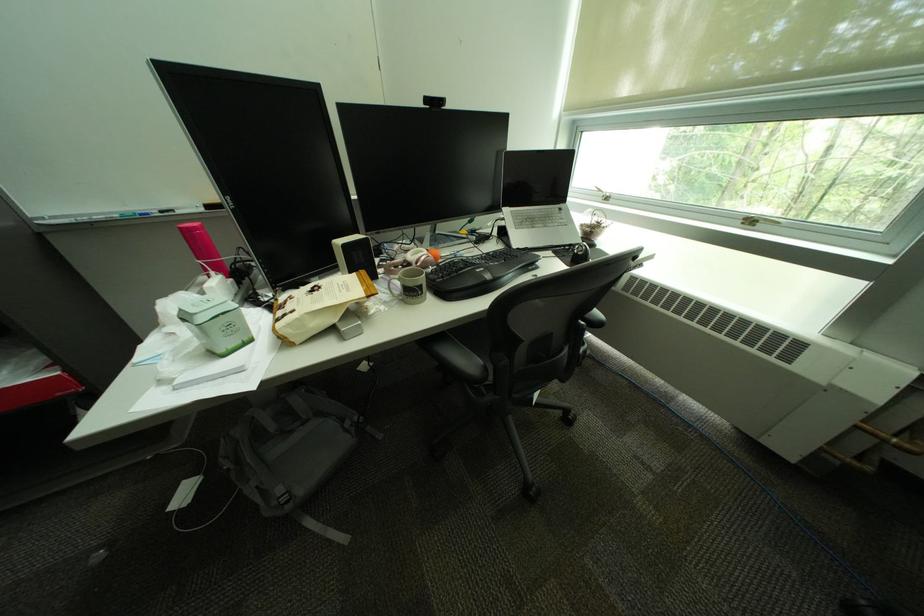
The location [215,323] corresponds to which object?

It corresponds to the green tin container in the image.